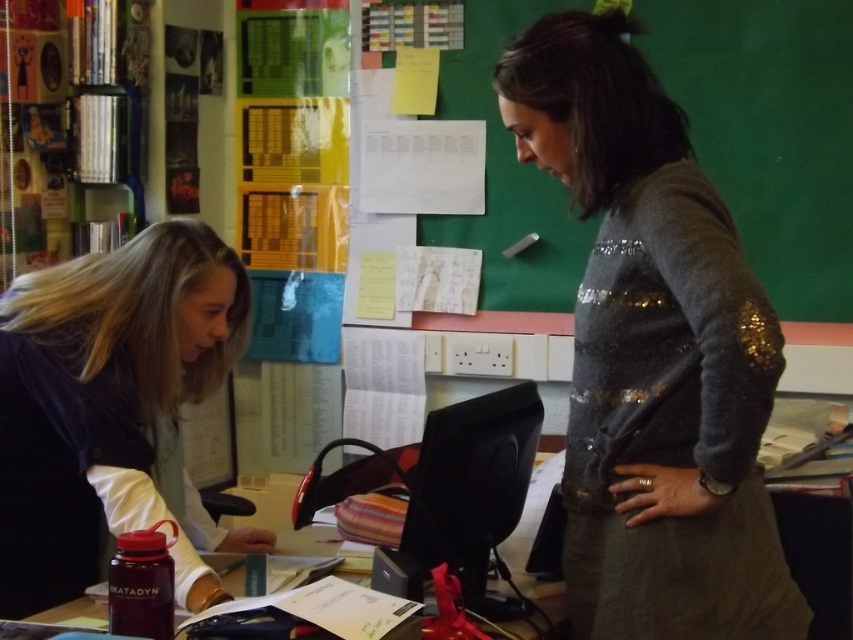
You are organizing a classroom and need to know which object occupies more horizontal space between the green matte bulletin board at upper center and the black glossy monitor at center. Based on their widths, which one is wider?

The green matte bulletin board at upper center is wider than the black glossy monitor at center because its width surpasses the monitor.

What is located at the point with coordinates (770, 131) in the image?

The point at coordinates (770, 131) corresponds to the green matte bulletin board at upper center.

You are standing in front of the desk in the classroom. You see two points marked on the desk surface. One is at coordinate point (543, 232) and the other is at point (416, 508). Which point is closer to you?

Point (543, 232) is further to the camera than point (416, 508), so the point closer to you is point (416, 508).